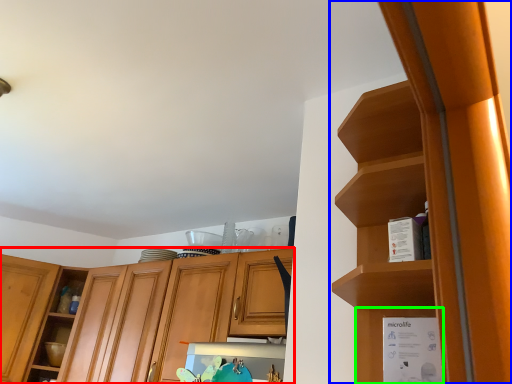
Question: Based on their relative distances, which object is farther from cabinetry (highlighted by a red box)? Choose from cabinetry (highlighted by a blue box) and cabinet (highlighted by a green box).

Choices:
 (A) cabinetry
 (B) cabinet

Answer: (B)